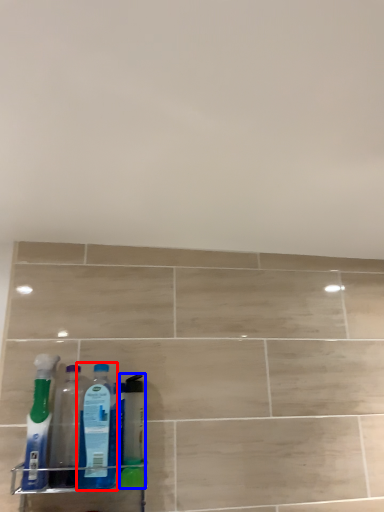
Question: Which of the following is the closest to the observer, bottle (highlighted by a red box) or cleaning product (highlighted by a blue box)?

Choices:
 (A) bottle
 (B) cleaning product

Answer: (A)